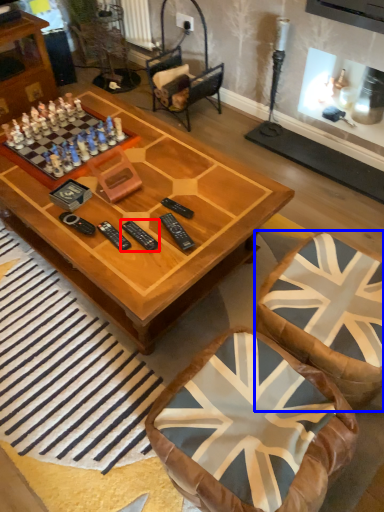
Question: Which object is further to the camera taking this photo, remote (highlighted by a red box) or swivel chair (highlighted by a blue box)?

Choices:
 (A) remote
 (B) swivel chair

Answer: (A)